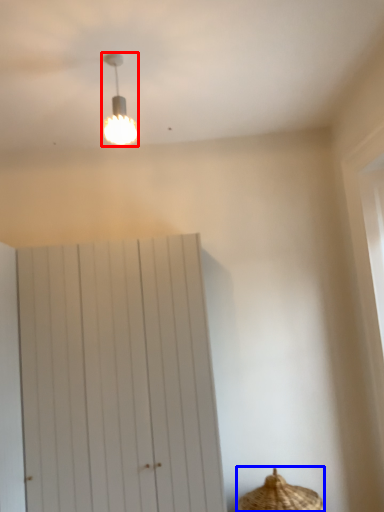
Question: Which object appears closest to the camera in this image, lamp (highlighted by a red box) or basket (highlighted by a blue box)?

Choices:
 (A) lamp
 (B) basket

Answer: (A)